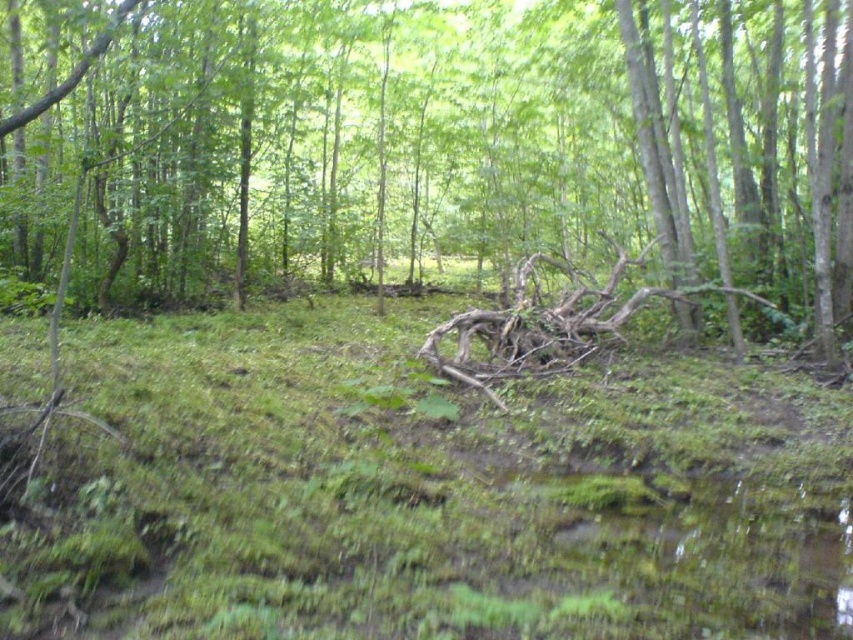
You are a hiker who has just spotted the brown wood log at center and the brown rough branch at center in the forest. You want to take a photo of both objects in the same frame. Considering their distance apart, can you estimate if they can be captured together in a single photo without moving your camera position?

The brown wood log at center is 37.37 feet away from the brown rough branch at center. Since they are positioned at the same central area but separated by over 37 feet, capturing both in one frame might require a wide angle lens or moving closer to reduce the distance between them in the photo.

Looking at this image, you are a hiker who wants to cross the slope in the forest. You see a brown wood log at center and a brown rough branch at center. Which object can you step on first if you walk straight ahead?

The brown wood log at center is larger in size than the brown rough branch at center, so the hiker can step on the brown wood log at center first.